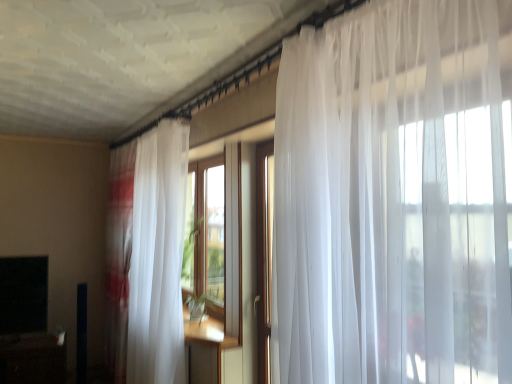
Question: Does black matte tv at lower left have a smaller size compared to sheer white curtain at left?

Choices:
 (A) no
 (B) yes

Answer: (B)

Question: From a real-world perspective, is black matte tv at lower left located beneath sheer white curtain at left?

Choices:
 (A) no
 (B) yes

Answer: (B)

Question: From the image's perspective, is black matte tv at lower left above sheer white curtain at left?

Choices:
 (A) no
 (B) yes

Answer: (A)

Question: Could you tell me if black matte tv at lower left is facing sheer white curtain at left?

Choices:
 (A) no
 (B) yes

Answer: (A)

Question: Does black matte tv at lower left have a lesser height compared to sheer white curtain at left?

Choices:
 (A) no
 (B) yes

Answer: (B)

Question: Relative to black matte tv at lower left, is black glossy table at lower left in front or behind?

Choices:
 (A) behind
 (B) front

Answer: (B)

Question: Looking at the image, does black glossy table at lower left seem bigger or smaller compared to black matte tv at lower left?

Choices:
 (A) big
 (B) small

Answer: (A)

Question: Considering the positions of black glossy table at lower left and black matte tv at lower left in the image, is black glossy table at lower left wider or thinner than black matte tv at lower left?

Choices:
 (A) thin
 (B) wide

Answer: (B)

Question: Considering the positions of point (1, 350) and point (42, 274), is point (1, 350) closer or farther from the camera than point (42, 274)?

Choices:
 (A) farther
 (B) closer

Answer: (B)

Question: Visually, is black matte tv at lower left positioned to the left or to the right of sheer white curtain at left?

Choices:
 (A) left
 (B) right

Answer: (A)

Question: Looking at the image, does black matte tv at lower left seem bigger or smaller compared to sheer white curtain at left?

Choices:
 (A) big
 (B) small

Answer: (B)

Question: Relative to sheer white curtain at left, is black matte tv at lower left in front or behind?

Choices:
 (A) behind
 (B) front

Answer: (A)

Question: From a real-world perspective, relative to sheer white curtain at left, is black matte tv at lower left vertically above or below?

Choices:
 (A) above
 (B) below

Answer: (B)

Question: Relative to black glossy table at lower left, is black matte tv at lower left in front or behind?

Choices:
 (A) behind
 (B) front

Answer: (A)

Question: Is black matte tv at lower left bigger or smaller than black glossy table at lower left?

Choices:
 (A) big
 (B) small

Answer: (B)